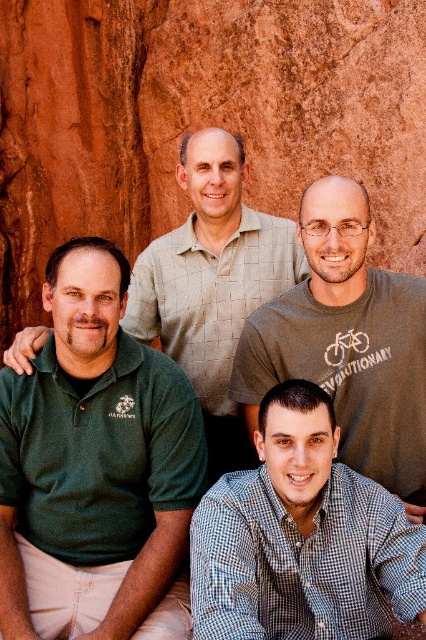
Question: Which object is closer to the camera taking this photo?

Choices:
 (A) green cotton polo shirt at upper center
 (B) checkered shirt at lower center

Answer: (B)

Question: Can you confirm if checkered shirt at lower center is smaller than green cotton shirt at upper center?

Choices:
 (A) yes
 (B) no

Answer: (A)

Question: Is green cotton shirt at upper center above green cotton polo shirt at upper center?

Choices:
 (A) yes
 (B) no

Answer: (B)

Question: Which object appears closest to the camera in this image?

Choices:
 (A) reddish-brown rock at center
 (B) green cotton shirt at upper center
 (C) green polo shirt at left

Answer: (C)

Question: Is checkered shirt at lower center to the right of green cotton shirt at upper center from the viewer's perspective?

Choices:
 (A) no
 (B) yes

Answer: (A)

Question: Which point is closer to the camera?

Choices:
 (A) checkered shirt at lower center
 (B) green cotton polo shirt at upper center

Answer: (A)